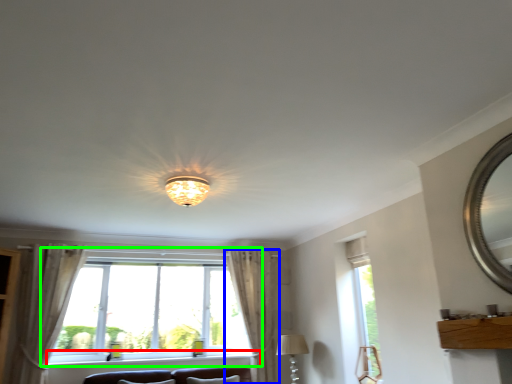
Question: Estimate the real-world distances between objects in this image. Which object is farther from window sill (highlighted by a red box), curtain (highlighted by a blue box) or window (highlighted by a green box)?

Choices:
 (A) curtain
 (B) window

Answer: (A)